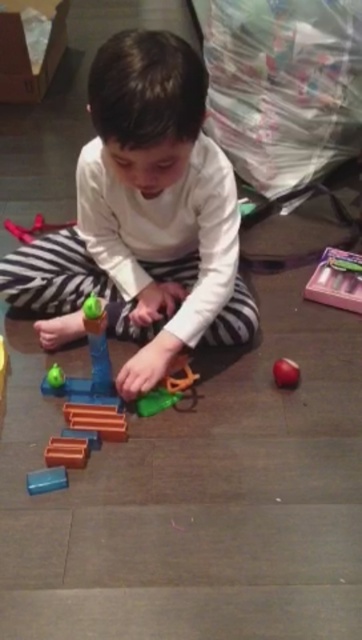
The child is playing with two items, the translucent blue block at lower left and the shiny red apple at lower right. Which of these two items takes up more space?

The shiny red apple at lower right takes up more space than the translucent blue block at lower left because the translucent blue block at lower left occupies less space than shiny red apple at lower right.

You are a photographer standing 2 meters away from the child. You want to take a photo of the point at coordinates point (179, 280). Is the point within your camera range?

The point (179, 280) is 1.57 meters away from the camera, so yes, it is within the photographer standing 2 meters away from the child.